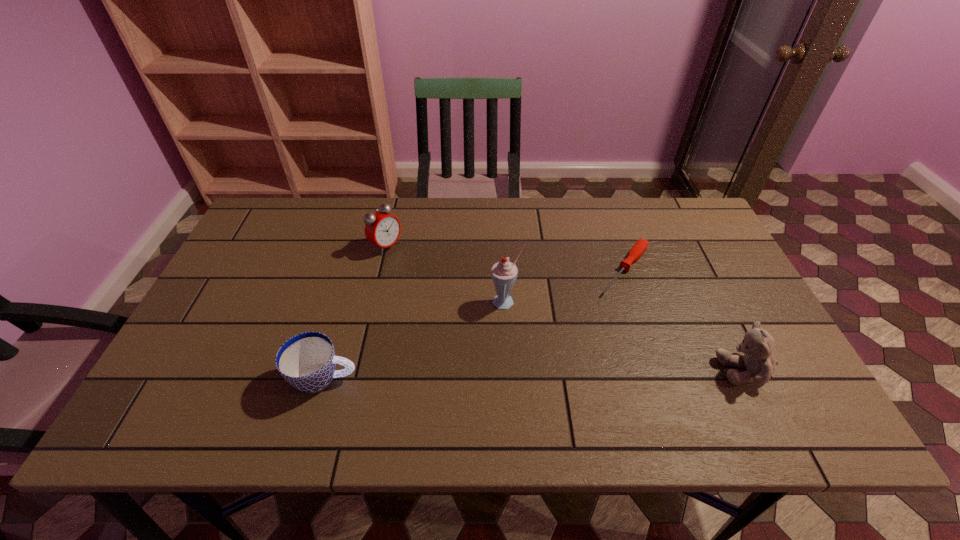
You are a GUI agent. You are given a task and a screenshot of the screen. Output one action in this format:
    pyautogui.click(x=<x>, y=<y>)
    Task: Click on the cup
    
    Given the screenshot: What is the action you would take?
    pyautogui.click(x=307, y=361)

Image resolution: width=960 pixels, height=540 pixels. In order to click on teddy bear in this screenshot , I will do `click(757, 346)`.

Identify the location of the tallest object. (504, 273).

Identify the location of milkshake. (504, 273).

Locate an element on the screen. This screenshot has height=540, width=960. the fourth object from left to right is located at coordinates (640, 246).

I want to click on screwdriver, so click(x=640, y=246).

Image resolution: width=960 pixels, height=540 pixels. I want to click on alarm clock, so click(x=383, y=229).

At what (x,y) coordinates should I click in order to perform the action: click on vacant space positioned on the side of the fourth tallest object with the handle. Please return your answer as a coordinate pair (x, y). This screenshot has width=960, height=540. Looking at the image, I should click on (460, 378).

Identify the location of free point located on the face of the rightmost object. (636, 370).

Locate an element on the screen. free region located 0.270m on the face of the rightmost object is located at coordinates pyautogui.click(x=601, y=370).